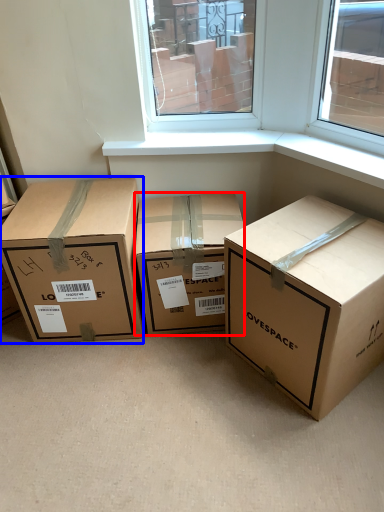
Question: Among these objects, which one is farthest to the camera, box (highlighted by a red box) or box (highlighted by a blue box)?

Choices:
 (A) box
 (B) box

Answer: (A)